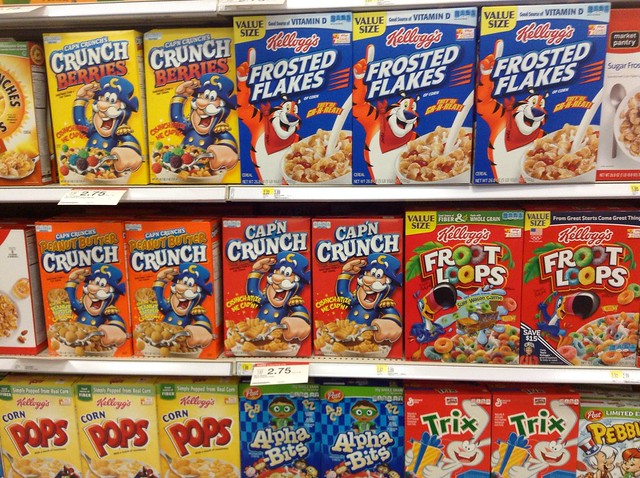
At what (x,y) coordinates should I click in order to perform the action: click on cereal boxes on middle shelf. Please return your answer as a coordinate pair (x, y). The width and height of the screenshot is (640, 478). Looking at the image, I should click on (20, 278), (56, 279), (144, 276), (253, 271), (340, 271), (438, 275), (548, 277).